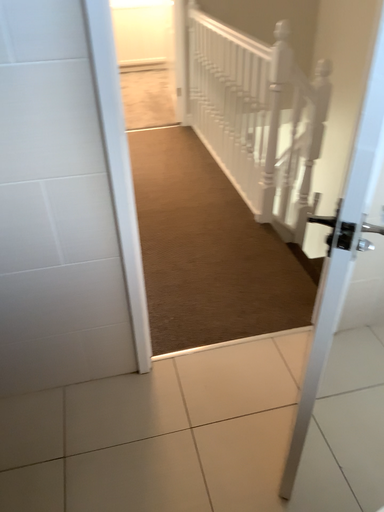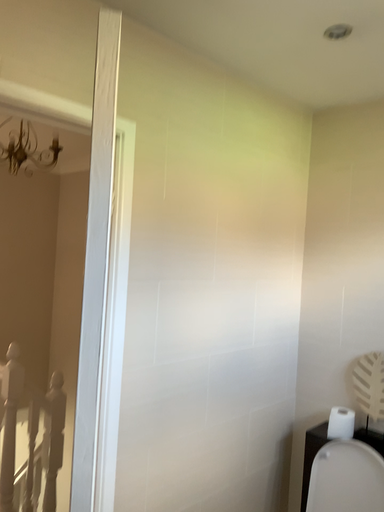
Question: How did the camera likely rotate when shooting the video?

Choices:
 (A) rotated upward
 (B) rotated downward

Answer: (A)